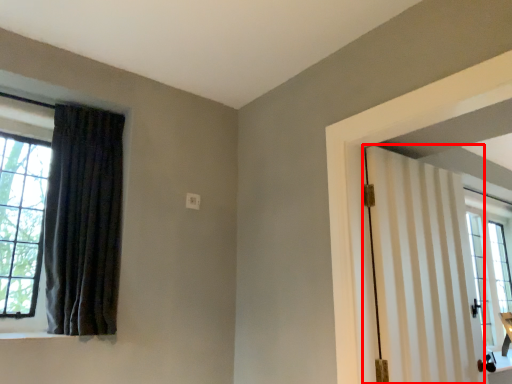
Question: From the image's perspective, where is door (annotated by the red box) located relative to curtain?

Choices:
 (A) above
 (B) below

Answer: (B)